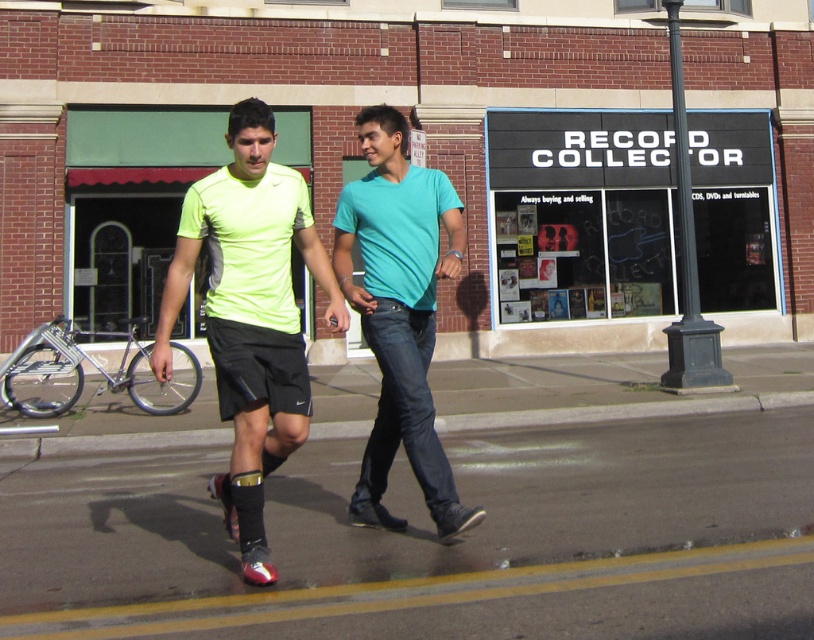
You are a photographer trying to capture a photo of both the neon green fabric shirt at center and the teal matte shirt at center. Since you want them to be side by side in the frame, which direction should you move the camera to ensure both are visible?

The neon green fabric shirt at center is positioned on the left side of teal matte shirt at center, so you should move the camera to the right to include both in the frame.

You are a clothing designer observing the two people in the image. You need to determine which shirt has a wider width between the neon green fabric shirt at center and the teal matte shirt at center. Which one is wider?

The neon green fabric shirt at center has a larger width than the teal matte shirt at center according to the description.